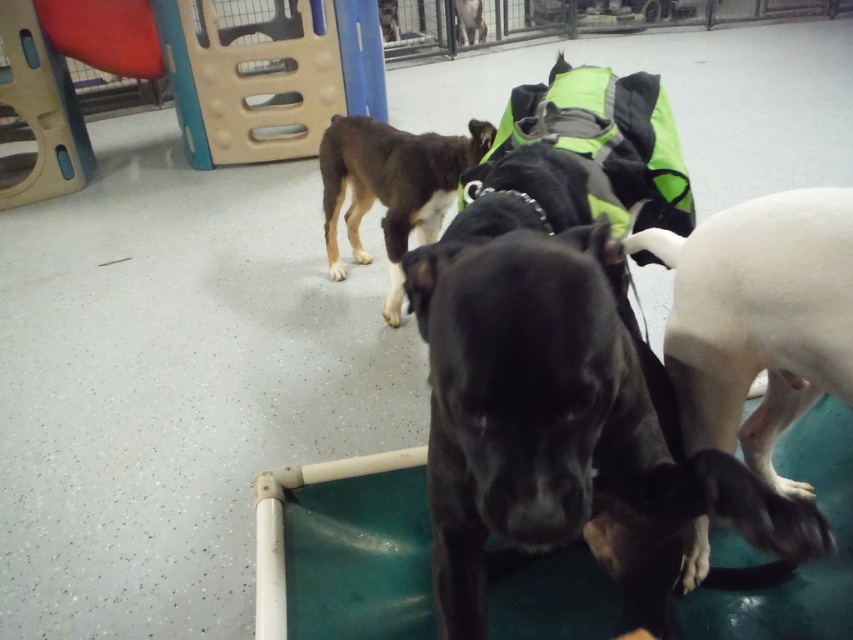
Does point (809, 516) lie behind point (459, 8)?

No, it is in front of (459, 8).

Does black smooth dog at center have a smaller size compared to brown fur dog at upper center?

Actually, black smooth dog at center might be larger than brown fur dog at upper center.

Does point (790, 509) come farther from viewer compared to point (467, 4)?

No, it is in front of (467, 4).

In order to click on black smooth dog at center in this screenshot , I will do `click(560, 426)`.

Where is `black smooth dog at center`? black smooth dog at center is located at coordinates (560, 426).

Between point (473, 413) and point (782, 195), which one is positioned behind?

The point (782, 195) is more distant.

Who is more distant from viewer, (650,506) or (753,202)?

The point (753,202) is behind.

Where is `black smooth dog at center`? black smooth dog at center is located at coordinates (560, 426).

Can you confirm if brown fur at upper left is shorter than brown fur dog at upper center?

Incorrect, brown fur at upper left's height does not fall short of brown fur dog at upper center's.

Can you confirm if brown fur at upper left is positioned to the left of brown fur dog at upper center?

Indeed, brown fur at upper left is positioned on the left side of brown fur dog at upper center.

In the scene shown: Who is more distant from viewer, (407,202) or (469,33)?

The point (469,33) is behind.

Image resolution: width=853 pixels, height=640 pixels. I want to click on brown fur at upper left, so point(392,186).